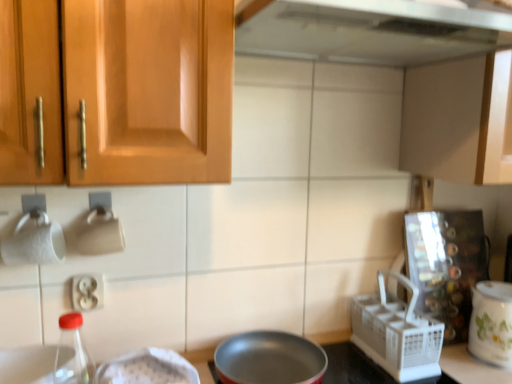
Question: From the image's perspective, is transparent glass bottle at lower left above white plastic basket at right?

Choices:
 (A) no
 (B) yes

Answer: (A)

Question: Is transparent glass bottle at lower left thinner than white plastic basket at right?

Choices:
 (A) yes
 (B) no

Answer: (A)

Question: Is transparent glass bottle at lower left bigger than white plastic basket at right?

Choices:
 (A) no
 (B) yes

Answer: (A)

Question: Is white plastic basket at right completely or partially inside transparent glass bottle at lower left?

Choices:
 (A) yes
 (B) no

Answer: (B)

Question: Is transparent glass bottle at lower left placed right next to white plastic basket at right?

Choices:
 (A) yes
 (B) no

Answer: (B)

Question: From a real-world perspective, relative to matte wood cabinet at upper right, is white plastic electrical outlet at lower left vertically above or below?

Choices:
 (A) above
 (B) below

Answer: (B)

Question: Is white plastic electrical outlet at lower left inside or outside of matte wood cabinet at upper right?

Choices:
 (A) inside
 (B) outside

Answer: (B)

Question: From the image's perspective, is white plastic electrical outlet at lower left positioned above or below matte wood cabinet at upper right?

Choices:
 (A) above
 (B) below

Answer: (B)

Question: Is white plastic electrical outlet at lower left in front of or behind matte wood cabinet at upper right in the image?

Choices:
 (A) front
 (B) behind

Answer: (B)

Question: Is white plastic basket at right inside or outside of matte wood cabinet at upper right?

Choices:
 (A) outside
 (B) inside

Answer: (A)

Question: From their relative heights in the image, would you say white plastic basket at right is taller or shorter than matte wood cabinet at upper right?

Choices:
 (A) tall
 (B) short

Answer: (B)

Question: Considering the positions of white plastic basket at right and matte wood cabinet at upper right in the image, is white plastic basket at right wider or thinner than matte wood cabinet at upper right?

Choices:
 (A) thin
 (B) wide

Answer: (A)

Question: Is point (415, 329) positioned closer to the camera than point (473, 82)?

Choices:
 (A) closer
 (B) farther

Answer: (B)

Question: Does point (68, 382) appear closer or farther from the camera than point (78, 307)?

Choices:
 (A) closer
 (B) farther

Answer: (A)

Question: Is transparent glass bottle at lower left in front of or behind white plastic electrical outlet at lower left in the image?

Choices:
 (A) front
 (B) behind

Answer: (A)